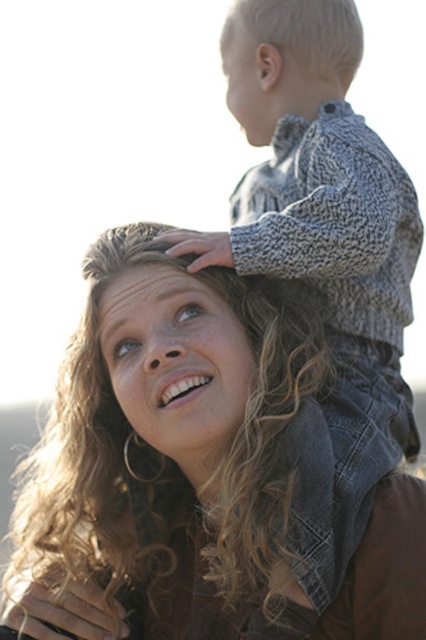
Between curly blonde hair at upper center and blonde hair at center, which one is positioned higher?

blonde hair at center is higher up.

Based on the photo, who is taller, curly blonde hair at upper center or blonde hair at center?

blonde hair at center

Measure the distance between point (299, 381) and camera.

A distance of 21.14 feet exists between point (299, 381) and camera.

Where is `curly blonde hair at upper center`? curly blonde hair at upper center is located at coordinates (170, 445).

Can you confirm if curly blonde hair at upper center is bigger than knitted gray sweater at upper right?

No, curly blonde hair at upper center is not bigger than knitted gray sweater at upper right.

From the picture: Is curly blonde hair at upper center taller than knitted gray sweater at upper right?

No.

This screenshot has width=426, height=640. What do you see at coordinates (170, 445) in the screenshot?
I see `curly blonde hair at upper center` at bounding box center [170, 445].

This screenshot has width=426, height=640. I want to click on curly blonde hair at upper center, so click(x=170, y=445).

Is point (209, 378) positioned after point (308, 83)?

No, it is not.

Is blonde hair at center in front of knitted gray sweater at upper right?

Yes.

Who is more forward, (146,333) or (259,124)?

Positioned in front is point (146,333).

Locate an element on the screen. This screenshot has height=640, width=426. blonde hair at center is located at coordinates (176, 348).